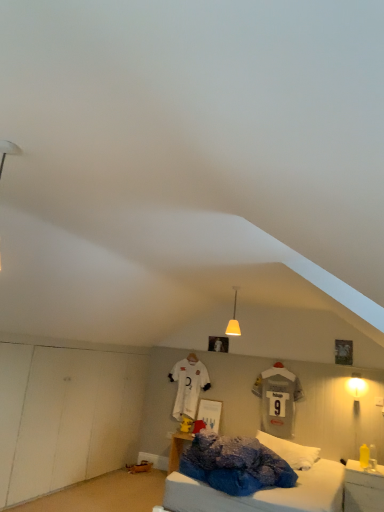
Question: Is matte yellow lampshade at right, the 1th light fixture when ordered from right to left, positioned far away from yellow plastic bottle at lower right?

Choices:
 (A) yes
 (B) no

Answer: (A)

Question: From the image's perspective, is matte yellow lampshade at right, the first light fixture positioned from the back, located above yellow plastic bottle at lower right?

Choices:
 (A) no
 (B) yes

Answer: (B)

Question: Is matte yellow lampshade at right, which is counted as the second light fixture, starting from the front, at the left side of yellow plastic bottle at lower right?

Choices:
 (A) yes
 (B) no

Answer: (B)

Question: Considering the relative positions of matte yellow lampshade at right, which is the second light fixture in top-to-bottom order, and yellow plastic bottle at lower right in the image provided, is matte yellow lampshade at right, which is the second light fixture in top-to-bottom order, to the right of yellow plastic bottle at lower right from the viewer's perspective?

Choices:
 (A) yes
 (B) no

Answer: (A)

Question: From the image's perspective, does matte yellow lampshade at right, the 1th light fixture when ordered from right to left, appear lower than yellow plastic bottle at lower right?

Choices:
 (A) no
 (B) yes

Answer: (A)

Question: From a real-world perspective, is matte yellow lampshade at right, which is the second light fixture in top-to-bottom order, physically below yellow plastic bottle at lower right?

Choices:
 (A) no
 (B) yes

Answer: (A)

Question: Does yellow plastic bottle at lower right turn towards matte yellow glass pendant light at center, placed as the 1th light fixture when sorted from top to bottom?

Choices:
 (A) yes
 (B) no

Answer: (B)

Question: Is yellow plastic bottle at lower right thinner than matte yellow glass pendant light at center, marked as the 1th light fixture in a left-to-right arrangement?

Choices:
 (A) yes
 (B) no

Answer: (B)

Question: Is yellow plastic bottle at lower right wider than matte yellow glass pendant light at center, arranged as the 1th light fixture when viewed from the front?

Choices:
 (A) no
 (B) yes

Answer: (B)

Question: Can you confirm if yellow plastic bottle at lower right is smaller than matte yellow glass pendant light at center, the 2th light fixture ordered from the bottom?

Choices:
 (A) no
 (B) yes

Answer: (A)

Question: Is matte yellow glass pendant light at center, arranged as the 1th light fixture when viewed from the front, surrounded by yellow plastic bottle at lower right?

Choices:
 (A) no
 (B) yes

Answer: (A)

Question: From a real-world perspective, is yellow plastic bottle at lower right on top of matte yellow glass pendant light at center, the 2th light fixture ordered from the bottom?

Choices:
 (A) no
 (B) yes

Answer: (A)

Question: Does matte yellow glass pendant light at center, placed as the 1th light fixture when sorted from top to bottom, have a lesser height compared to matte yellow lampshade at right, marked as the 2th light fixture in a left-to-right arrangement?

Choices:
 (A) no
 (B) yes

Answer: (A)